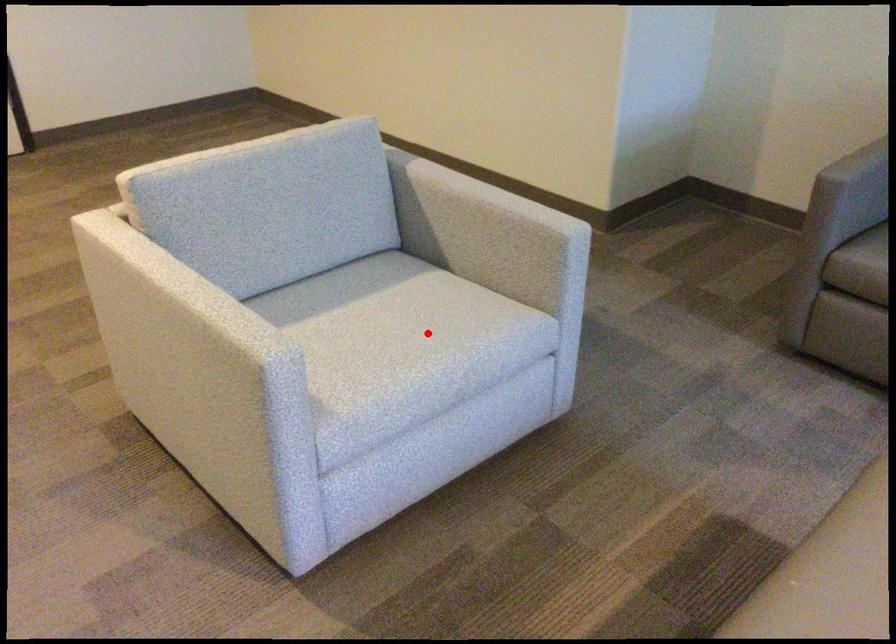
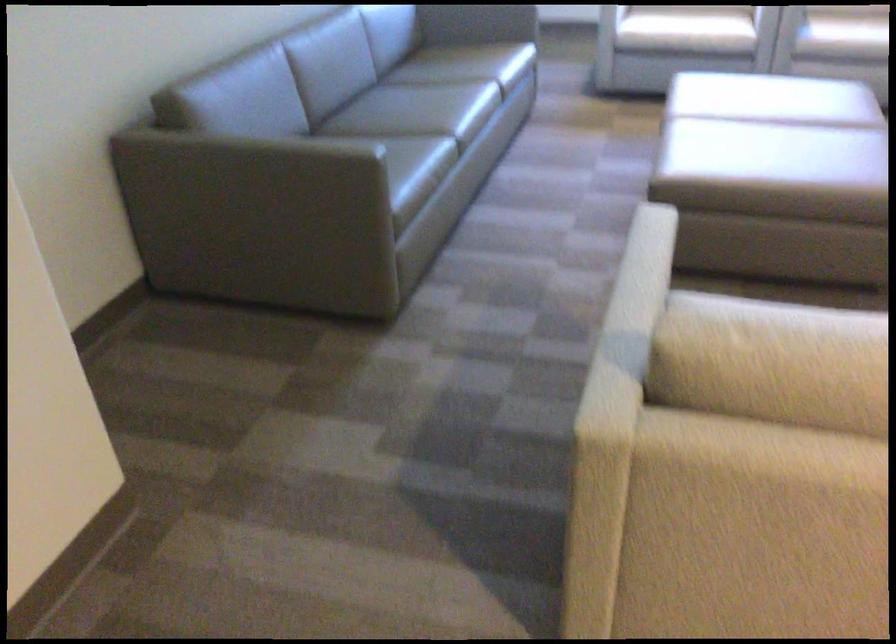
Question: I am providing you with two images of the same scene from different viewpoints. A red point is marked on the first image. At the location where the point appears in image 1, is it still visible in image 2?

Choices:
 (A) Yes
 (B) No

Answer: (B)